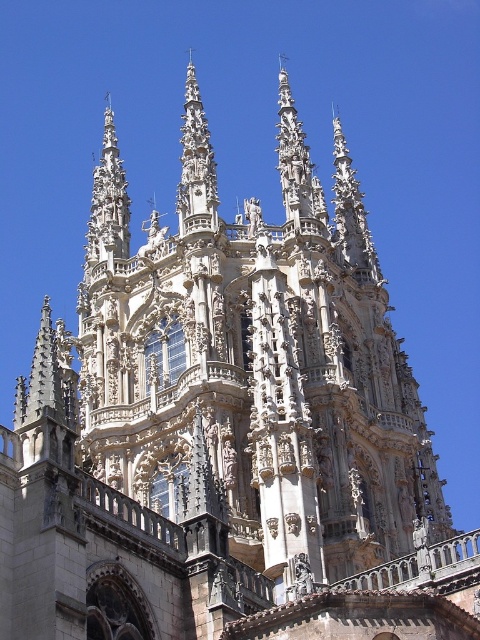
Question: Can you confirm if polished stone spire at center is bigger than carved stone spire at upper left?

Choices:
 (A) yes
 (B) no

Answer: (B)

Question: Among these objects, which one is farthest from the camera?

Choices:
 (A) polished stone spire at center
 (B) carved stone spire at upper left

Answer: (B)

Question: Does polished stone spire at center have a greater width compared to carved stone spire at upper left?

Choices:
 (A) no
 (B) yes

Answer: (A)

Question: Among these points, which one is farthest from the camera?

Choices:
 (A) (184, 104)
 (B) (111, 168)

Answer: (A)

Question: Does polished stone spire at center appear under carved stone spire at upper left?

Choices:
 (A) no
 (B) yes

Answer: (A)